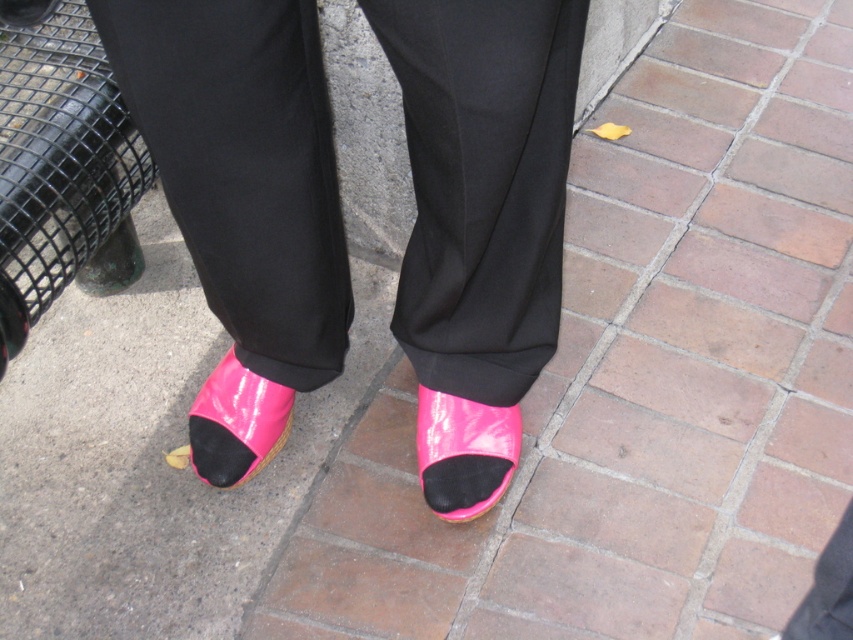
You are a photographer trying to capture the pink glossy sandal at lower center. However, the black smooth pants at center is blocking your view. Can you move the pants to get a clear shot of the sandal?

The black smooth pants at center is in front of the pink glossy sandal at lower center, so you would need to move the pants to get a clear view of the sandal.

You are a photographer setting up a shoot. You need to position a camera so that both the pink glossy shoe at lower center and the pink glossy sandal at lower center are in focus. The camera has a depth of field that can cover 10 inches. Can you capture both items in focus without adjusting the camera settings?

The pink glossy shoe at lower center is 9.94 inches away from the pink glossy sandal at lower center. Since the distance between them is less than the camera depth of field of 10 inches, both items can be captured in focus without adjusting the camera settings.